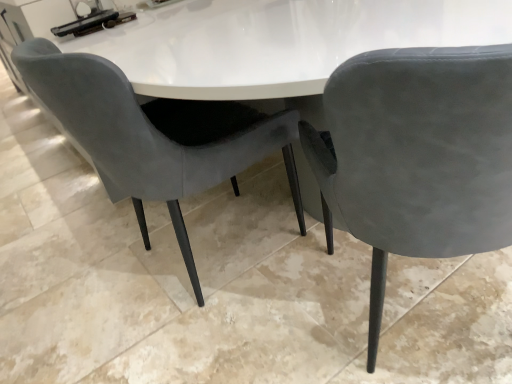
Locate an element on the screen. This screenshot has height=384, width=512. vacant area in front of suede gray chair at center, acting as the 1th chair starting from the left is located at coordinates (227, 341).